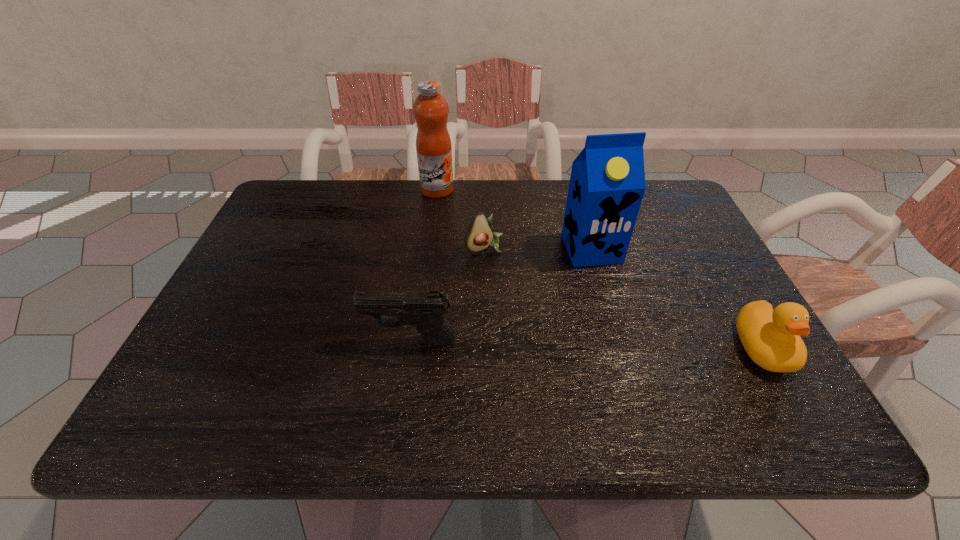
Image resolution: width=960 pixels, height=540 pixels. Identify the location of empty space between the second object from right to left and the third object from left to right. (538, 248).

This screenshot has width=960, height=540. Find the location of `free spot between the fruit juice and the third object from left to right`. free spot between the fruit juice and the third object from left to right is located at coordinates (461, 218).

At what (x,y) coordinates should I click in order to perform the action: click on vacant area that lies between the avocado and the duck. Please return your answer as a coordinate pair (x, y). The height and width of the screenshot is (540, 960). Looking at the image, I should click on (624, 298).

Where is `free space that is in between the avocado and the pistol`? Image resolution: width=960 pixels, height=540 pixels. free space that is in between the avocado and the pistol is located at coordinates (447, 294).

This screenshot has width=960, height=540. I want to click on object that is the fourth closest to the pistol, so click(771, 338).

Locate which object is the fourth closest to the duck. Please provide its 2D coordinates. Your answer should be formatted as a tuple, i.e. [(x, y)], where the tuple contains the x and y coordinates of a point satisfying the conditions above.

[(430, 109)]

Identify the location of vacant space that satisfies the following two spatial constraints: 1. on the front side of the avocado; 2. on the right side of the farthest object. (430, 247).